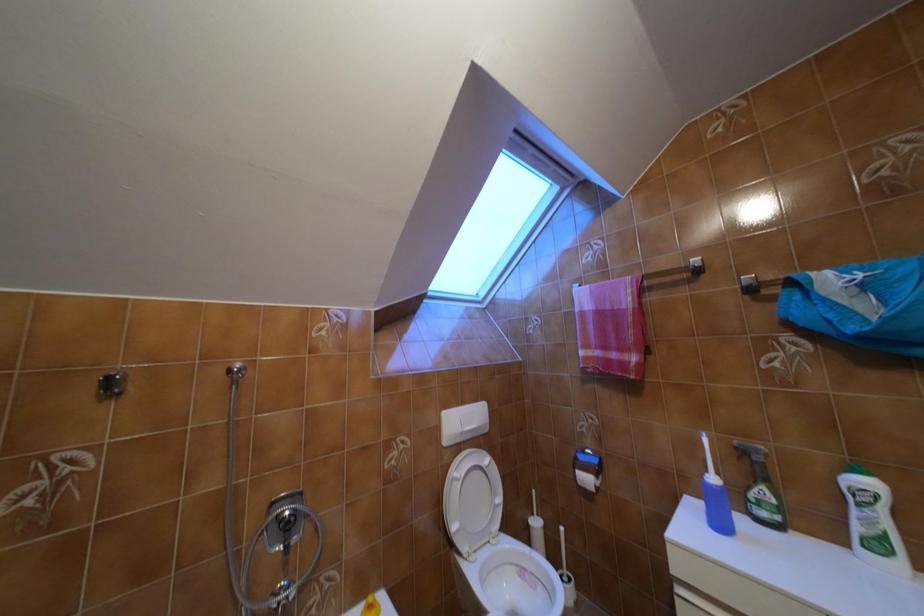
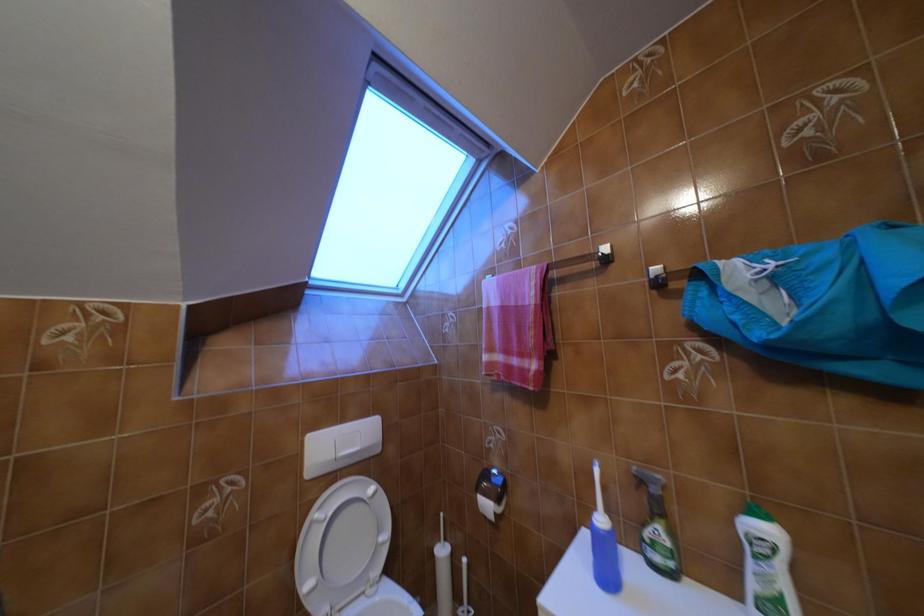
Question: The camera is either moving clockwise (left) or counter-clockwise (right) around the object. The first image is from the beginning of the video and the second image is from the end. Is the camera moving left or right when shooting the video?

Choices:
 (A) Left
 (B) Right

Answer: (A)